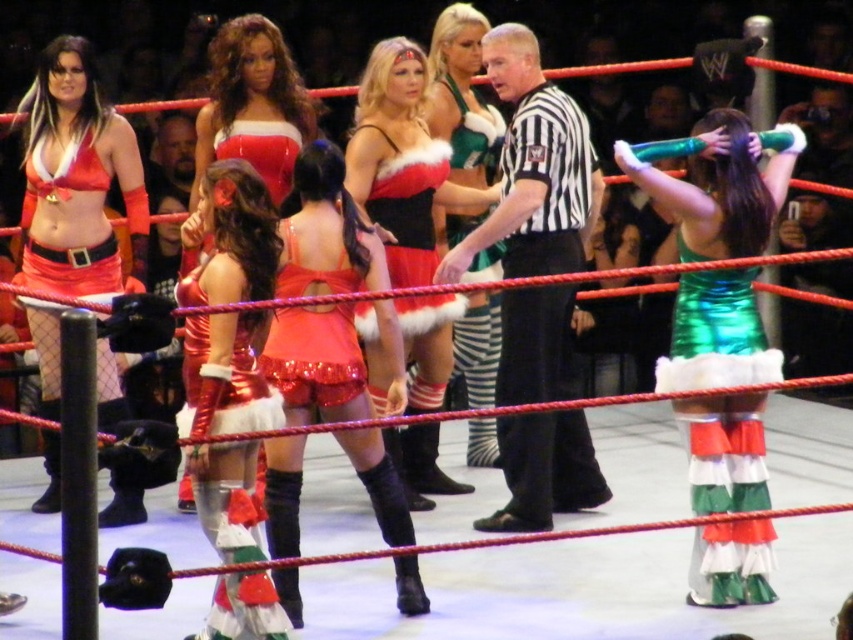
You are a photographer positioned at the back of the wrestling ring. You need to capture a photo where both the black striped shirt at center and the shiny sequined dress at center are clearly visible. Given their heights, which object should you focus on first to ensure both are in frame?

The black striped shirt at center is taller than the shiny sequined dress at center. To ensure both are in frame, focus on the taller object first, which is the black striped shirt at center, then adjust the camera angle to include the shorter shiny sequined dress at center.

You are a photographer positioned at the center of the wrestling ring. You want to take a photo that includes both the point at (691, 438) and the point at (538, 323). Which point should you focus on first to ensure both are in the frame?

You should focus on point (538, 323) first because it is behind point (691, 438). By focusing on the farther point, you can ensure both are within the depth of field.